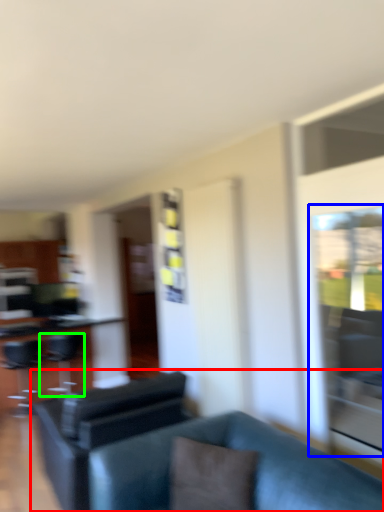
Question: Considering the real-world distances, which object is closest to studio couch (highlighted by a red box)? glass door (highlighted by a blue box) or swivel chair (highlighted by a green box).

Choices:
 (A) glass door
 (B) swivel chair

Answer: (A)